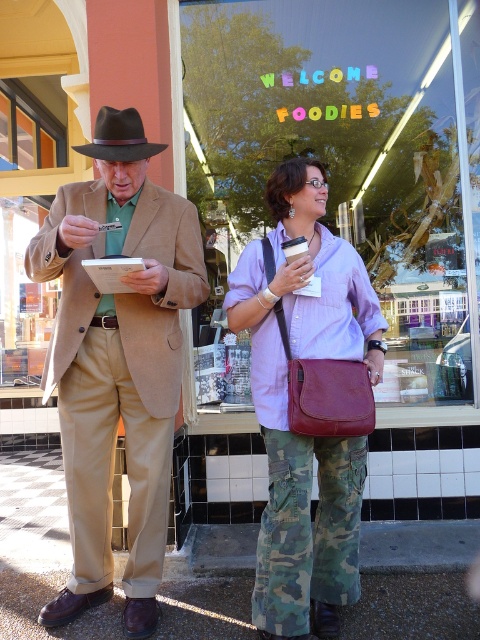
Which is more to the right, matte glass window at center or matte brown suit at center?

Positioned to the right is matte glass window at center.

Where is `matte glass window at center`? The image size is (480, 640). matte glass window at center is located at coordinates (343, 156).

Is matte purple shirt at center to the left of black felt fedora at upper left from the viewer's perspective?

No, matte purple shirt at center is not to the left of black felt fedora at upper left.

Between matte purple shirt at center and black felt fedora at upper left, which one is positioned lower?

matte purple shirt at center

Where is `matte purple shirt at center`? The image size is (480, 640). matte purple shirt at center is located at coordinates (287, 404).

Locate an element on the screen. Image resolution: width=480 pixels, height=640 pixels. matte purple shirt at center is located at coordinates (287, 404).

Can you confirm if matte glass window at center is positioned to the right of black felt fedora at upper left?

Correct, you'll find matte glass window at center to the right of black felt fedora at upper left.

Between point (395, 224) and point (154, 147), which one is positioned in front?

Point (154, 147)

Describe the element at coordinates (343, 156) in the screenshot. I see `matte glass window at center` at that location.

Locate an element on the screen. Image resolution: width=480 pixels, height=640 pixels. matte glass window at center is located at coordinates (343, 156).